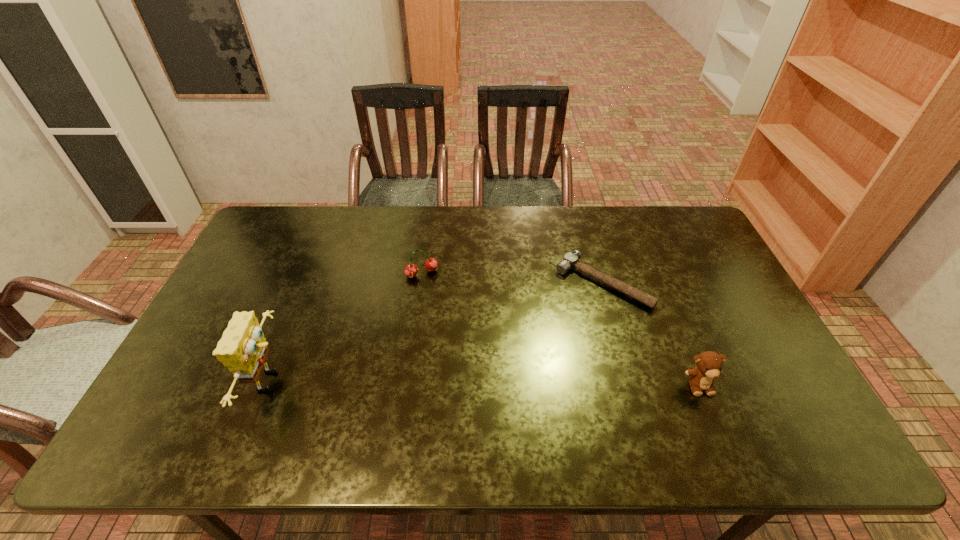
At what (x,y) coordinates should I click in order to perform the action: click on the leftmost object. Please return your answer as a coordinate pair (x, y). Looking at the image, I should click on (243, 349).

Locate an element on the screen. This screenshot has height=540, width=960. the tallest object is located at coordinates (243, 349).

The width and height of the screenshot is (960, 540). In order to click on teddy bear in this screenshot , I will do `click(709, 364)`.

Find the location of a particular element. The height and width of the screenshot is (540, 960). cherry is located at coordinates (411, 270).

Identify the location of the shortest object. (570, 261).

I want to click on vacant area situated on the face of the tallest object, so click(x=409, y=381).

Locate an element on the screen. Image resolution: width=960 pixels, height=540 pixels. blank space located 0.310m with stems pointing upwards on the second object from left to right is located at coordinates (465, 355).

Find the location of a particular element. vacant area situated with stems pointing upwards on the second object from left to right is located at coordinates tap(446, 319).

Where is `vacant space located with stems pointing upwards on the second object from left to right`? The image size is (960, 540). vacant space located with stems pointing upwards on the second object from left to right is located at coordinates (434, 293).

What are the coordinates of `vacant point located on the striking face of the shortest object` in the screenshot? It's located at (524, 362).